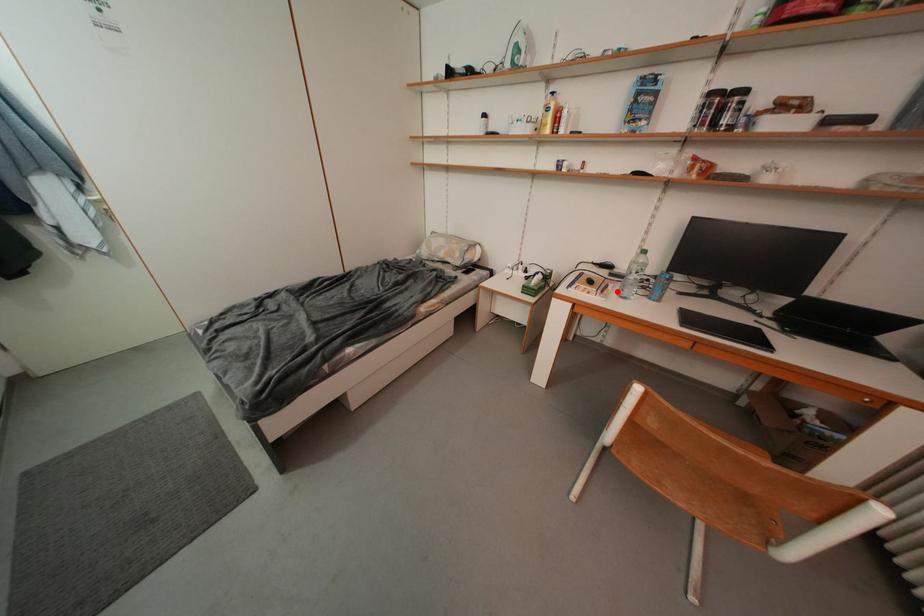
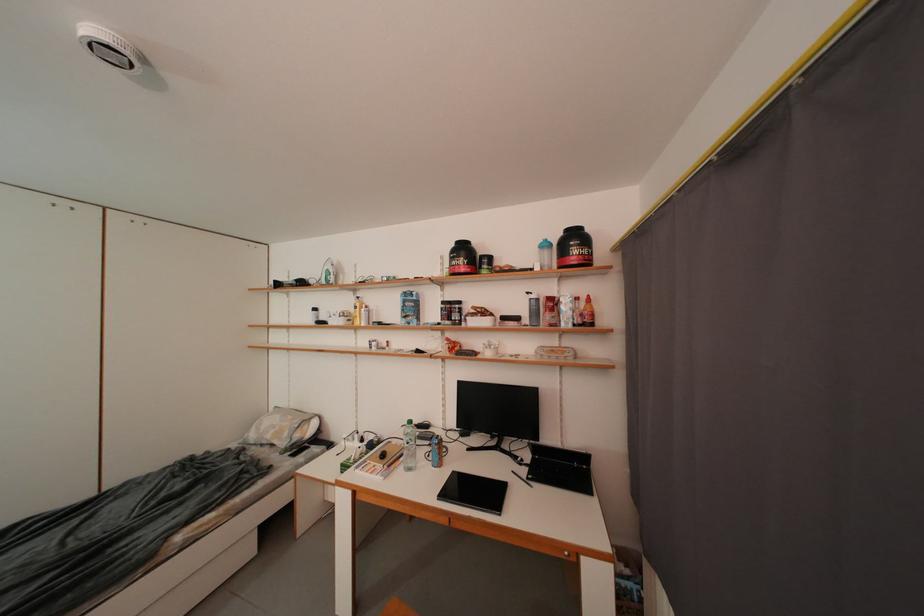
In the second image, find the point that corresponds to the highlighted location in the first image.

(409, 462)